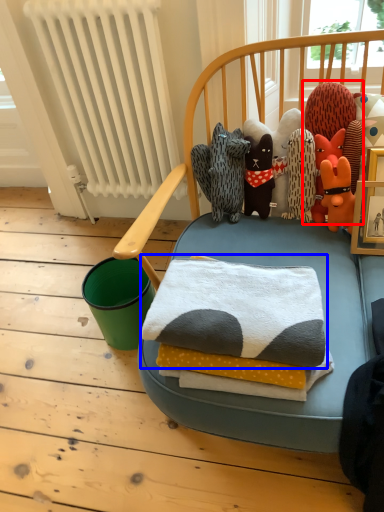
Question: Which point is closer to the camera, toy (highlighted by a red box) or bath towel (highlighted by a blue box)?

Choices:
 (A) toy
 (B) bath towel

Answer: (B)